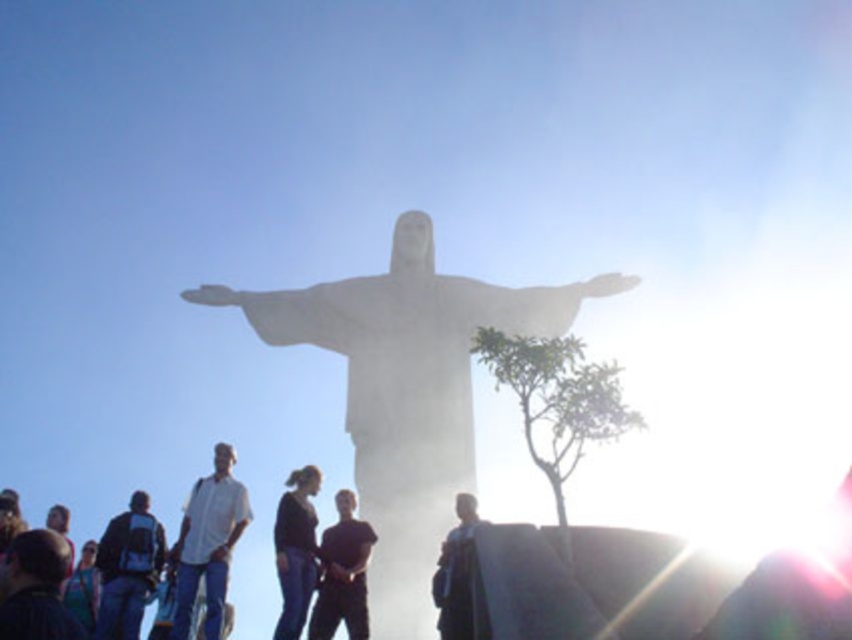
You are a photographer trying to capture a clear photo of the black matte shirt at center without the dark blue jeans at lower left blocking it. What adjustment should you make to your camera position?

Move your camera position to the right so that the dark blue jeans at lower left is no longer in front of the black matte shirt at center.

You are a photographer trying to capture the statue of Christ the Redeemer from a specific viewpoint. The statue is marked by the point at coordinates point (407, 392). If you want to avoid the glare from the sun, which is on the right side of the image, where should you position yourself relative to the statue?

To avoid the glare from the sun on the right side of the image, you should position yourself to the left of the statue marked by point (407, 392) so that the statue is between you and the sun.